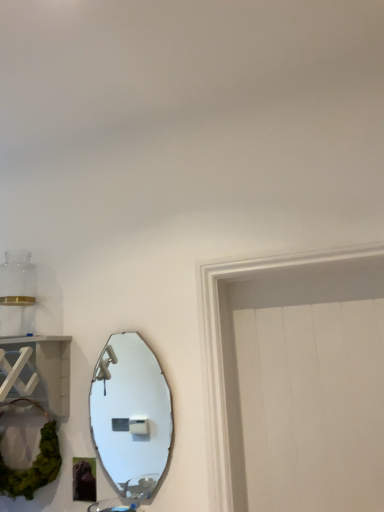
Describe the element at coordinates (36, 371) in the screenshot. I see `white wood shelf at left` at that location.

Where is `white wood shelf at left`? This screenshot has height=512, width=384. white wood shelf at left is located at coordinates (36, 371).

In order to face white wood shelf at left, should I rotate leftwards or rightwards?

Turn left by 24.205 degrees to look at white wood shelf at left.

Where is `matte silver mirror at center-left`? Image resolution: width=384 pixels, height=512 pixels. matte silver mirror at center-left is located at coordinates (131, 415).

Describe the element at coordinates (131, 415) in the screenshot. I see `matte silver mirror at center-left` at that location.

I want to click on white wood shelf at left, so click(36, 371).

Does matte silver mirror at center-left appear on the right side of white wood shelf at left?

Yes.

Consider the image. Considering the relative positions of matte silver mirror at center-left and white wood shelf at left in the image provided, is matte silver mirror at center-left in front of white wood shelf at left?

No, matte silver mirror at center-left is further to the viewer.

Which point is more distant from viewer, (107, 469) or (18, 390)?

The point (107, 469) is farther from the camera.

From the image's perspective, who appears lower, matte silver mirror at center-left or white wood shelf at left?

matte silver mirror at center-left, from the image's perspective.

From a real-world perspective, is matte silver mirror at center-left physically located above or below white wood shelf at left?

Clearly, from a real-world perspective, matte silver mirror at center-left is below white wood shelf at left.

Looking at this image, which of these two, matte silver mirror at center-left or white wood shelf at left, is thinner?

With smaller width is matte silver mirror at center-left.

Does matte silver mirror at center-left have a lesser height compared to white wood shelf at left?

No, matte silver mirror at center-left is not shorter than white wood shelf at left.

Considering the relative sizes of matte silver mirror at center-left and white wood shelf at left in the image provided, is matte silver mirror at center-left bigger than white wood shelf at left?

No.

Is white wood shelf at left located within matte silver mirror at center-left?

That's incorrect, white wood shelf at left is not inside matte silver mirror at center-left.

Is matte silver mirror at center-left placed right next to white wood shelf at left?

There is a gap between matte silver mirror at center-left and white wood shelf at left.

Is matte silver mirror at center-left looking in the opposite direction of white wood shelf at left?

No, matte silver mirror at center-left is not facing away from white wood shelf at left.

Can you tell me how much matte silver mirror at center-left and white wood shelf at left differ in facing direction?

The facing directions of matte silver mirror at center-left and white wood shelf at left are 1.21 degrees apart.

How far apart are matte silver mirror at center-left and white wood shelf at left?

matte silver mirror at center-left and white wood shelf at left are 4.94 feet apart from each other.

The height and width of the screenshot is (512, 384). What are the coordinates of `cabinet located in front of the matte silver mirror at center-left` in the screenshot? It's located at (36, 371).

Between white wood shelf at left and matte silver mirror at center-left, which one appears on the right side from the viewer's perspective?

matte silver mirror at center-left.

In the scene shown: Which is in front, white wood shelf at left or matte silver mirror at center-left?

white wood shelf at left is closer to the camera.

Considering the positions of point (45, 404) and point (154, 480), is point (45, 404) closer or farther from the camera than point (154, 480)?

Clearly, point (45, 404) is closer to the camera than point (154, 480).

From the image's perspective, between white wood shelf at left and matte silver mirror at center-left, who is located below?

matte silver mirror at center-left.

From a real-world perspective, who is located lower, white wood shelf at left or matte silver mirror at center-left?

matte silver mirror at center-left.

Based on the photo, considering the sizes of white wood shelf at left and matte silver mirror at center-left in the image, is white wood shelf at left wider or thinner than matte silver mirror at center-left?

In the image, white wood shelf at left appears to be wider than matte silver mirror at center-left.

Can you confirm if white wood shelf at left is shorter than matte silver mirror at center-left?

Indeed, white wood shelf at left has a lesser height compared to matte silver mirror at center-left.

Can you confirm if white wood shelf at left is smaller than matte silver mirror at center-left?

Actually, white wood shelf at left might be larger than matte silver mirror at center-left.

Would you say white wood shelf at left is outside matte silver mirror at center-left?

Yes, white wood shelf at left is located beyond the bounds of matte silver mirror at center-left.

Are white wood shelf at left and matte silver mirror at center-left making contact?

white wood shelf at left is not next to matte silver mirror at center-left, and they're not touching.

Could you tell me if white wood shelf at left is turned towards matte silver mirror at center-left?

No, white wood shelf at left is not aimed at matte silver mirror at center-left.

What's the angular difference between white wood shelf at left and matte silver mirror at center-left's facing directions?

They differ by 1.21 degrees in their facing directions.

The image size is (384, 512). Find the location of `cabinet to the left of matte silver mirror at center-left`. cabinet to the left of matte silver mirror at center-left is located at coordinates (36, 371).

Where is `cabinet in front of the matte silver mirror at center-left`? The height and width of the screenshot is (512, 384). cabinet in front of the matte silver mirror at center-left is located at coordinates (36, 371).

Image resolution: width=384 pixels, height=512 pixels. Identify the location of mirror behind the white wood shelf at left. (131, 415).